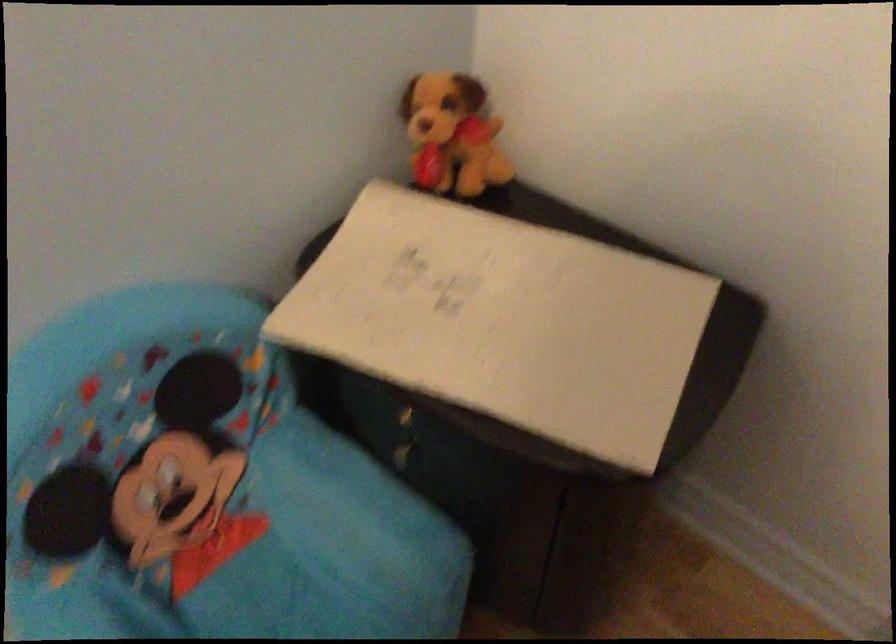
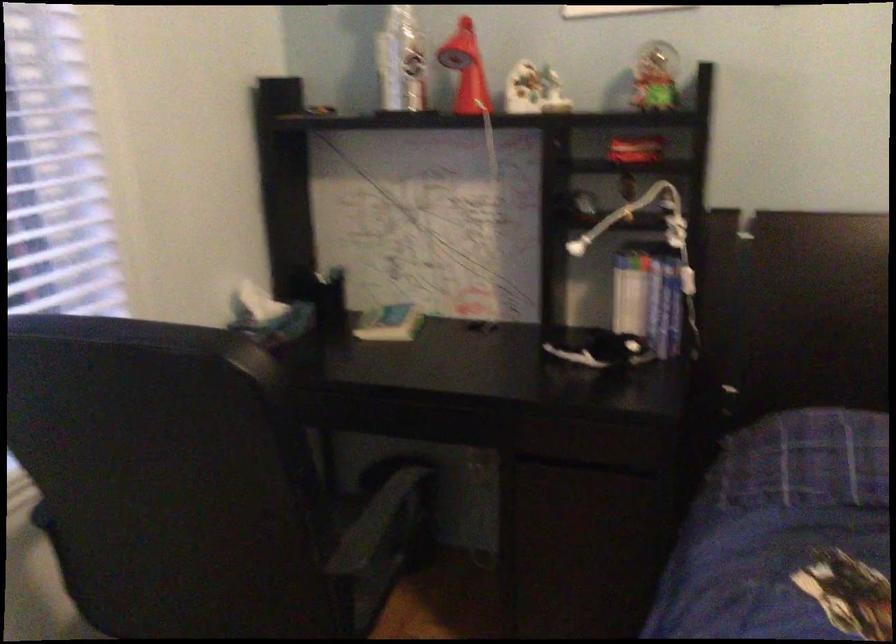
First-person continuous shooting, in which direction is the camera rotating?

The camera rotated toward right-down.